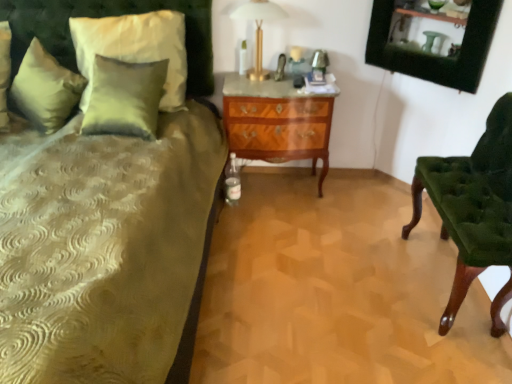
Question: From a real-world perspective, is velvet green chair at right below satin green pillow at upper left, acting as the first pillow starting from the left?

Choices:
 (A) yes
 (B) no

Answer: (A)

Question: From the image's perspective, is velvet green chair at right beneath satin green pillow at upper left, acting as the first pillow starting from the left?

Choices:
 (A) no
 (B) yes

Answer: (B)

Question: Is satin green pillow at upper left, acting as the first pillow starting from the left, at the back of velvet green chair at right?

Choices:
 (A) yes
 (B) no

Answer: (B)

Question: Can you confirm if velvet green chair at right is taller than satin green pillow at upper left, acting as the first pillow starting from the left?

Choices:
 (A) no
 (B) yes

Answer: (B)

Question: Could you tell me if velvet green chair at right is facing satin green pillow at upper left, acting as the first pillow starting from the left?

Choices:
 (A) no
 (B) yes

Answer: (B)

Question: Is velvet green chair at right with satin green pillow at upper left, acting as the first pillow starting from the left?

Choices:
 (A) yes
 (B) no

Answer: (B)

Question: Is there a large distance between satin green pillow at upper left, placed as the second pillow when sorted from left to right, and velvet green headboard at upper left?

Choices:
 (A) no
 (B) yes

Answer: (A)

Question: Is satin green pillow at upper left, placed as the second pillow when sorted from left to right, not inside velvet green headboard at upper left?

Choices:
 (A) yes
 (B) no

Answer: (A)

Question: Is satin green pillow at upper left, the 1th pillow when ordered from right to left, taller than velvet green headboard at upper left?

Choices:
 (A) no
 (B) yes

Answer: (A)

Question: Is satin green pillow at upper left, placed as the second pillow when sorted from left to right, beside velvet green headboard at upper left?

Choices:
 (A) yes
 (B) no

Answer: (B)

Question: Does satin green pillow at upper left, placed as the second pillow when sorted from left to right, have a lesser width compared to velvet green headboard at upper left?

Choices:
 (A) yes
 (B) no

Answer: (A)

Question: Is satin green pillow at upper left, the 1th pillow when ordered from right to left, smaller than velvet green headboard at upper left?

Choices:
 (A) yes
 (B) no

Answer: (A)

Question: Would you say velvet green headboard at upper left is part of satin green pillow at upper left, acting as the first pillow starting from the left,'s contents?

Choices:
 (A) no
 (B) yes

Answer: (A)